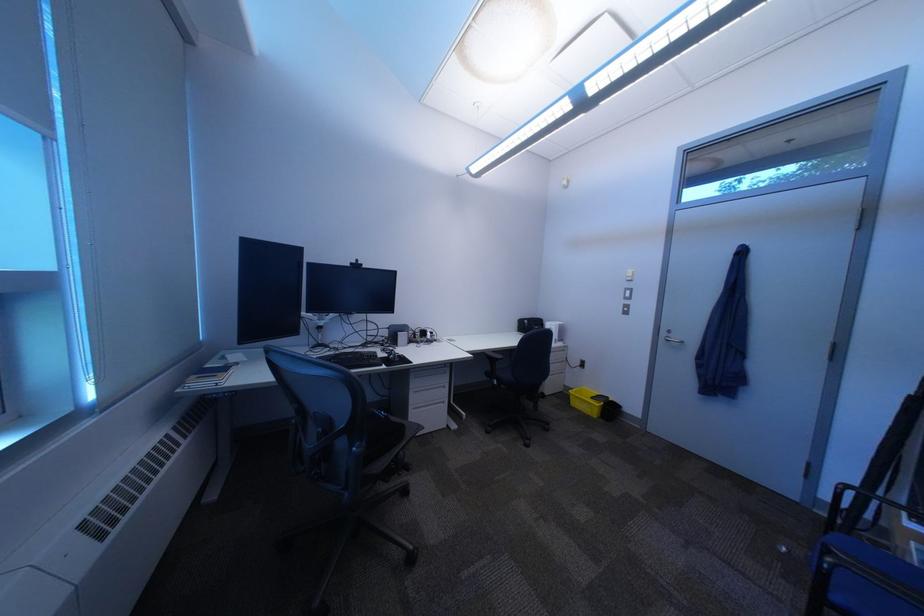
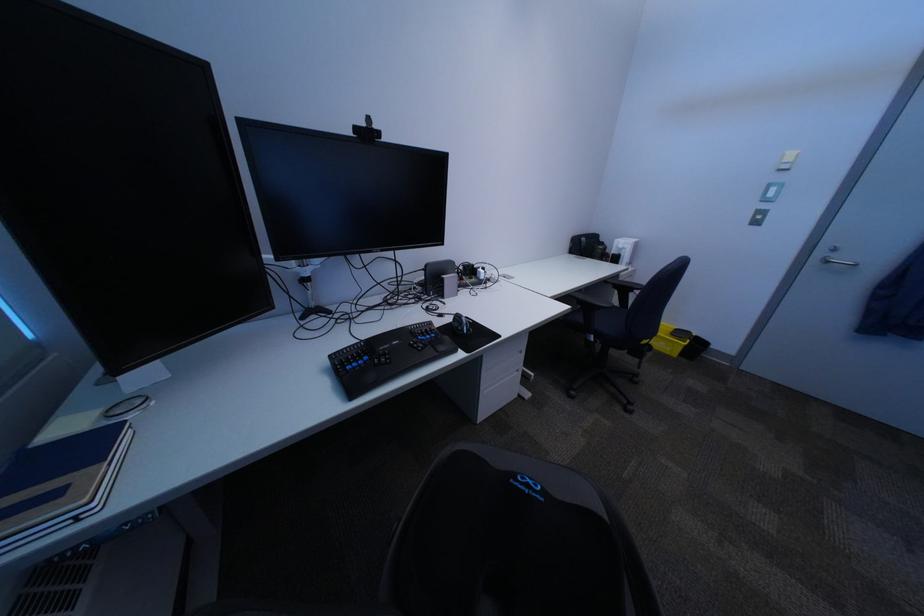
In a continuous first-person perspective shot, in which direction is the camera moving?

The cameraman moved toward left, forward.